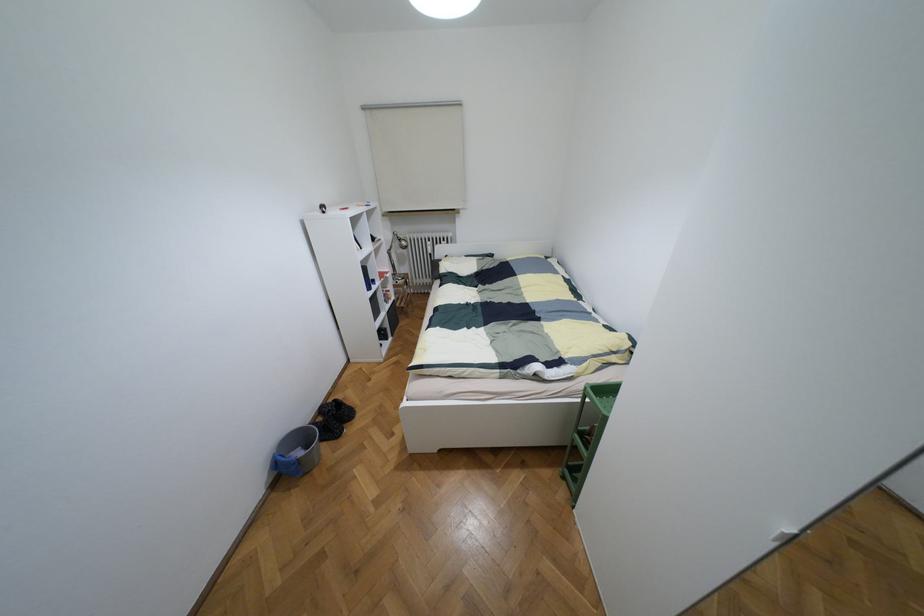
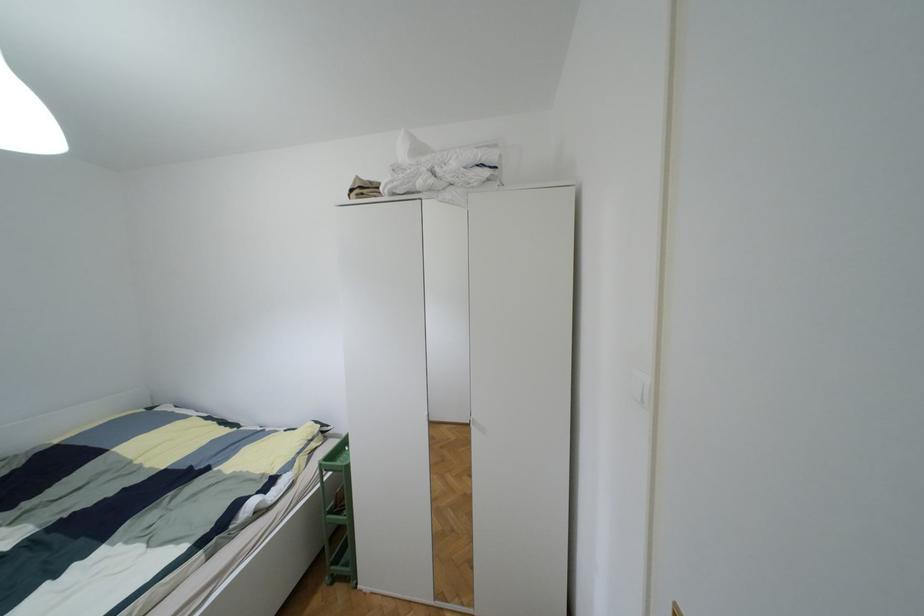
Where in the second image is the point corresponding to (563,477) from the first image?

(333, 578)